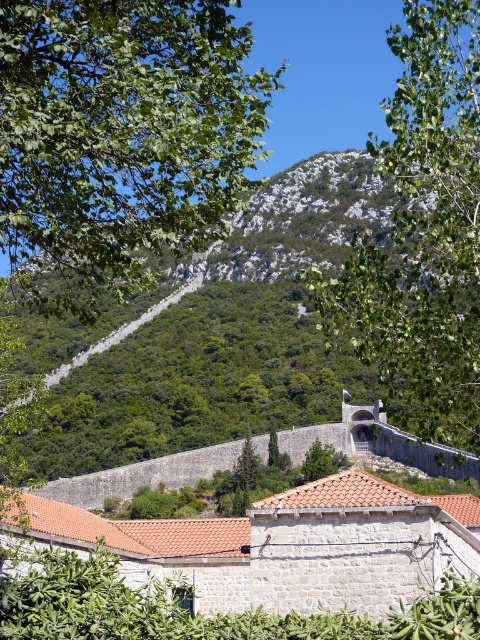
You are hiking on a mountain trail and want to take a photo of the green leafy tree at upper left and the green leafy mountain at center. Which object should you focus on first to ensure both are in the frame?

You should focus on the green leafy tree at upper left first because it is closer to the viewer than the green leafy mountain at center, so adjusting the focus starting from the closer object will help capture both in the frame.

You are a hiker planning to take a photo of the green leafy tree at upper left and the green leafy tree at center. Which tree would you need to frame wider in your camera to capture its full width?

The green leafy tree at upper left has a greater width than the green leafy tree at center, so you would need to frame the green leafy tree at upper left wider to capture its full width.